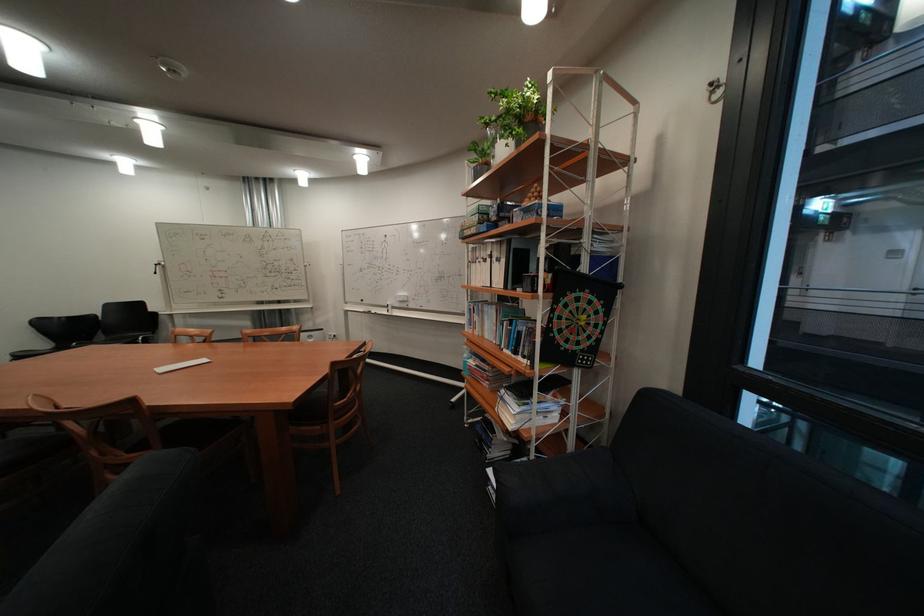
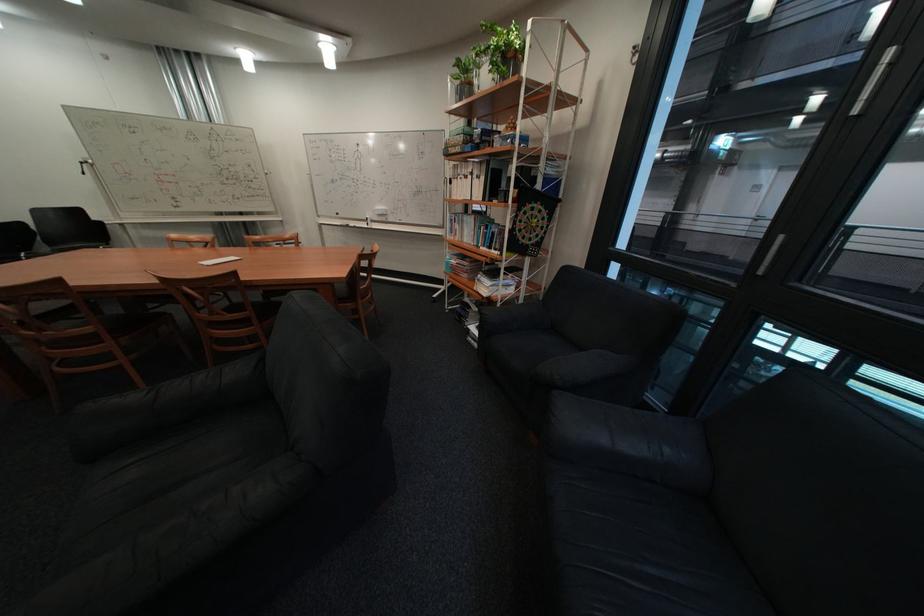
Question: The first image is from the beginning of the video and the second image is from the end. How did the camera likely rotate when shooting the video?

Choices:
 (A) Left
 (B) Right
 (C) Up
 (D) Down

Answer: (D)